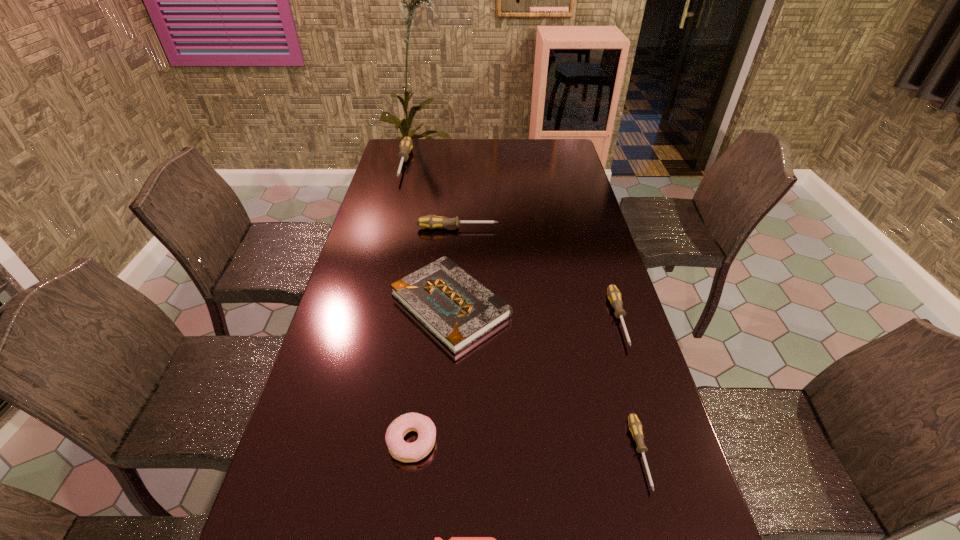
The image size is (960, 540). What are the coordinates of `free space located at the tip of the biggest gray screwdriver` in the screenshot? It's located at (393, 207).

At what (x,y) coordinates should I click in order to perform the action: click on vacant area situated at the tip of the second farthest object. Please return your answer as a coordinate pair (x, y). The image size is (960, 540). Looking at the image, I should click on 515,228.

Where is `vacant space located 0.360m on the back of the notebook`? The height and width of the screenshot is (540, 960). vacant space located 0.360m on the back of the notebook is located at coordinates (457, 206).

I want to click on vacant area located on the left of the doughnut, so click(343, 441).

Locate an element on the screen. vacant region located at the tip of the rightmost gray screwdriver is located at coordinates (642, 392).

Identify the location of object present at the far edge. The width and height of the screenshot is (960, 540). (406, 145).

At what (x,y) coordinates should I click in order to perform the action: click on screwdriver that is at the left edge. Please return your answer as a coordinate pair (x, y). Image resolution: width=960 pixels, height=540 pixels. Looking at the image, I should click on (406, 145).

Locate an element on the screen. This screenshot has height=540, width=960. notebook located in the left edge section of the desktop is located at coordinates (457, 309).

This screenshot has height=540, width=960. What are the coordinates of `object present at the far left corner` in the screenshot? It's located at (406, 145).

This screenshot has height=540, width=960. What are the coordinates of `vacant space at the far edge of the desktop` in the screenshot? It's located at (501, 143).